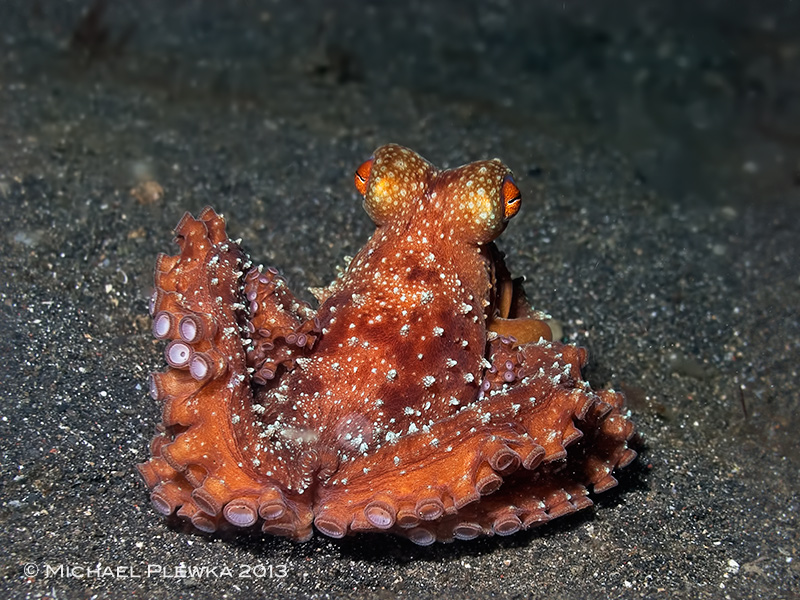
The width and height of the screenshot is (800, 600). I want to click on suction cup, so click(x=266, y=517).